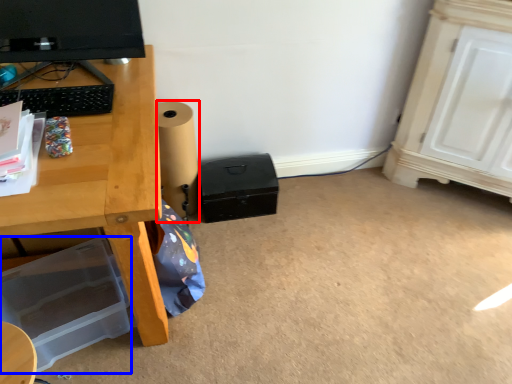
Question: Which of the following is the closest to the observer, speaker (highlighted by a red box) or box (highlighted by a blue box)?

Choices:
 (A) speaker
 (B) box

Answer: (B)